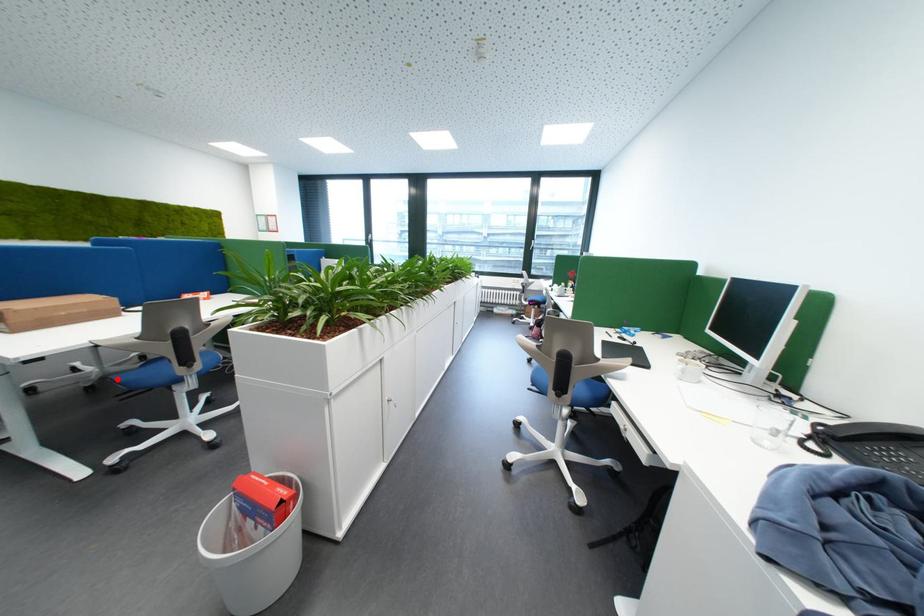
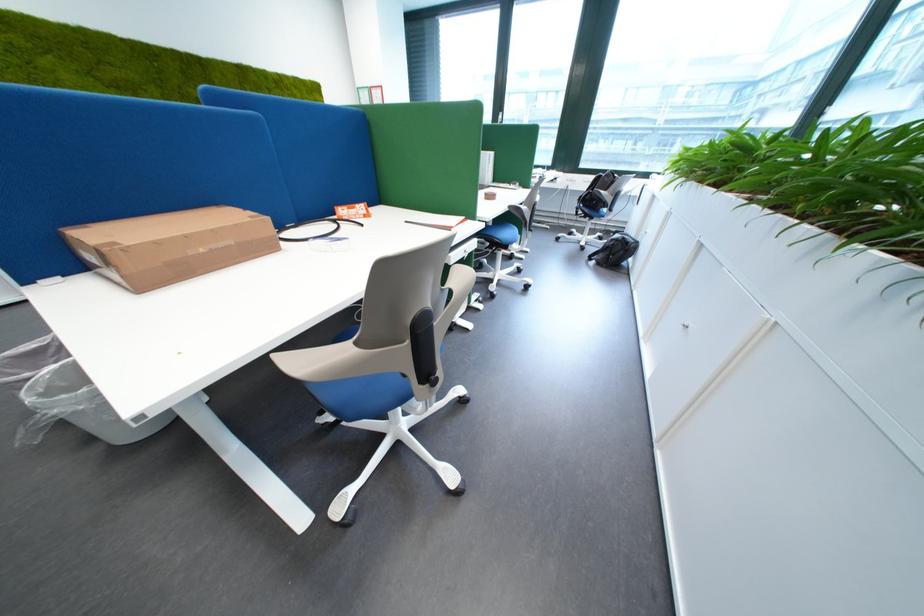
Question: I am providing you with two images of the same scene from different viewpoints. A red point is marked on the first image. Is the red point's position out of view in image 2?

Choices:
 (A) Yes
 (B) No

Answer: (A)